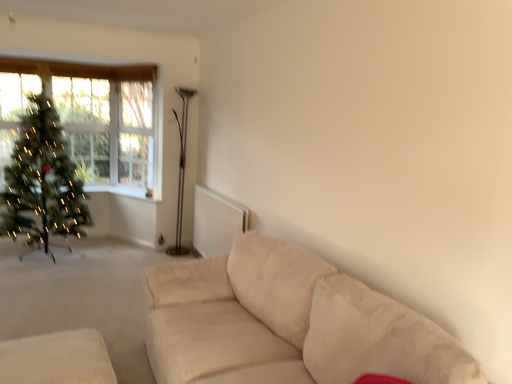
Question: Does metallic silver floor lamp at center have a smaller size compared to green matte christmas tree at left?

Choices:
 (A) yes
 (B) no

Answer: (A)

Question: Is metallic silver floor lamp at center next to green matte christmas tree at left?

Choices:
 (A) no
 (B) yes

Answer: (A)

Question: Can you confirm if metallic silver floor lamp at center is taller than green matte christmas tree at left?

Choices:
 (A) no
 (B) yes

Answer: (B)

Question: From a real-world perspective, is metallic silver floor lamp at center below green matte christmas tree at left?

Choices:
 (A) no
 (B) yes

Answer: (A)

Question: Considering the relative sizes of metallic silver floor lamp at center and green matte christmas tree at left in the image provided, is metallic silver floor lamp at center wider than green matte christmas tree at left?

Choices:
 (A) no
 (B) yes

Answer: (A)

Question: From a real-world perspective, is green matte christmas tree at left above or below beige fabric ottoman at lower left?

Choices:
 (A) below
 (B) above

Answer: (B)

Question: From their relative heights in the image, would you say green matte christmas tree at left is taller or shorter than beige fabric ottoman at lower left?

Choices:
 (A) short
 (B) tall

Answer: (B)

Question: Is green matte christmas tree at left wider or thinner than beige fabric ottoman at lower left?

Choices:
 (A) wide
 (B) thin

Answer: (A)

Question: Would you say green matte christmas tree at left is to the left or to the right of beige fabric ottoman at lower left in the picture?

Choices:
 (A) right
 (B) left

Answer: (B)

Question: In the image, is green matte christmas tree at left positioned in front of or behind clear glass window at upper left?

Choices:
 (A) front
 (B) behind

Answer: (A)

Question: Visually, is green matte christmas tree at left positioned to the left or to the right of clear glass window at upper left?

Choices:
 (A) right
 (B) left

Answer: (B)

Question: Considering the positions of green matte christmas tree at left and clear glass window at upper left in the image, is green matte christmas tree at left bigger or smaller than clear glass window at upper left?

Choices:
 (A) big
 (B) small

Answer: (A)

Question: Does point (36, 112) appear closer or farther from the camera than point (130, 115)?

Choices:
 (A) farther
 (B) closer

Answer: (B)

Question: From a real-world perspective, is clear glass window at upper left positioned above or below beige fabric ottoman at lower left?

Choices:
 (A) above
 (B) below

Answer: (A)

Question: From the image's perspective, relative to beige fabric ottoman at lower left, is clear glass window at upper left above or below?

Choices:
 (A) below
 (B) above

Answer: (B)